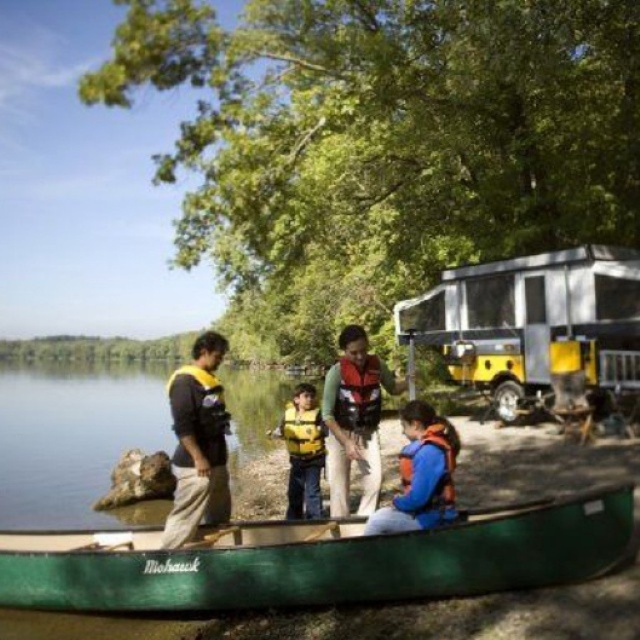
Does matte orange life vest at center appear under blue fabric life jacket at lower center?

Indeed, matte orange life vest at center is positioned under blue fabric life jacket at lower center.

Is matte orange life vest at center above blue fabric life jacket at lower center?

Incorrect, matte orange life vest at center is not positioned above blue fabric life jacket at lower center.

What are the coordinates of `matte orange life vest at center` in the screenshot? It's located at (355, 419).

This screenshot has width=640, height=640. I want to click on matte orange life vest at center, so click(355, 419).

Is point (182, 416) positioned after point (346, 364)?

No, (182, 416) is in front of (346, 364).

Which of these two, matte yellow life vest at left or red matte life jacket at center, stands shorter?

Standing shorter between the two is red matte life jacket at center.

Between point (225, 492) and point (380, 385), which one is positioned in front?

Point (225, 492) is more forward.

Where is `matte yellow life vest at left`? The height and width of the screenshot is (640, 640). matte yellow life vest at left is located at coordinates (198, 442).

Who is positioned more to the left, green matte canoe at center or red matte life jacket at center?

Positioned to the left is green matte canoe at center.

Is green matte canoe at center positioned before red matte life jacket at center?

No, green matte canoe at center is further to the viewer.

Find the location of a particular element. green matte canoe at center is located at coordinates (320, 560).

The width and height of the screenshot is (640, 640). I want to click on green matte canoe at center, so click(320, 560).